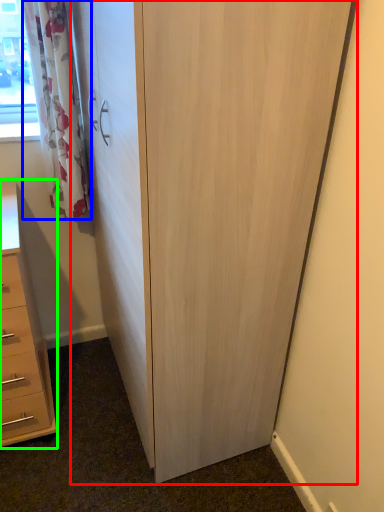
Question: Which is nearer to the cupboard (highlighted by a red box)? curtain (highlighted by a blue box) or chest of drawers (highlighted by a green box).

Choices:
 (A) curtain
 (B) chest of drawers

Answer: (A)